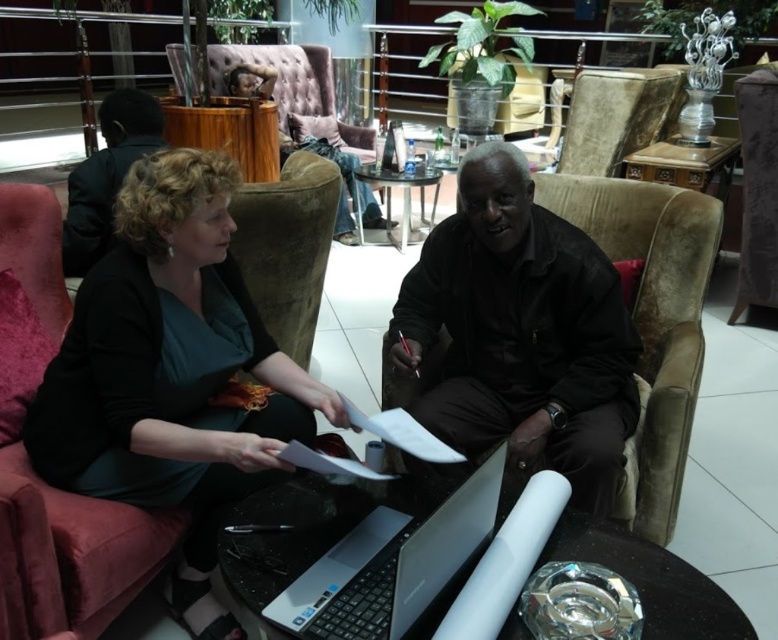
You are standing at point (419,534) and want to walk to the door located at point (156,189). Is there a clear path between these two points?

Point (156,189) is behind point (419,534), so there is no clear path between them. You may need to go around or take another route.

You are a guest at the meeting and need to borrow the silver metallic laptop at center from the owner. The owner is wearing the dark brown leather jacket at upper left. To reach the laptop without disturbing the owner, should you walk around the coffee table to your left or to your right?

You should walk around the coffee table to your right. The silver metallic laptop at center is in front of the dark brown leather jacket at upper left, meaning the owner is seated behind the laptop. By moving to your right, you can access the laptop from the side opposite the owner, minimizing disturbance.

You are a delivery person who needs to place a small package between the matte black jacket at center and the silver metallic laptop at center. Can you fit the package in the space between them?

The space between the matte black jacket at center and the silver metallic laptop at center is 47.11 centimeters, so yes, the small package can fit in the space between them.